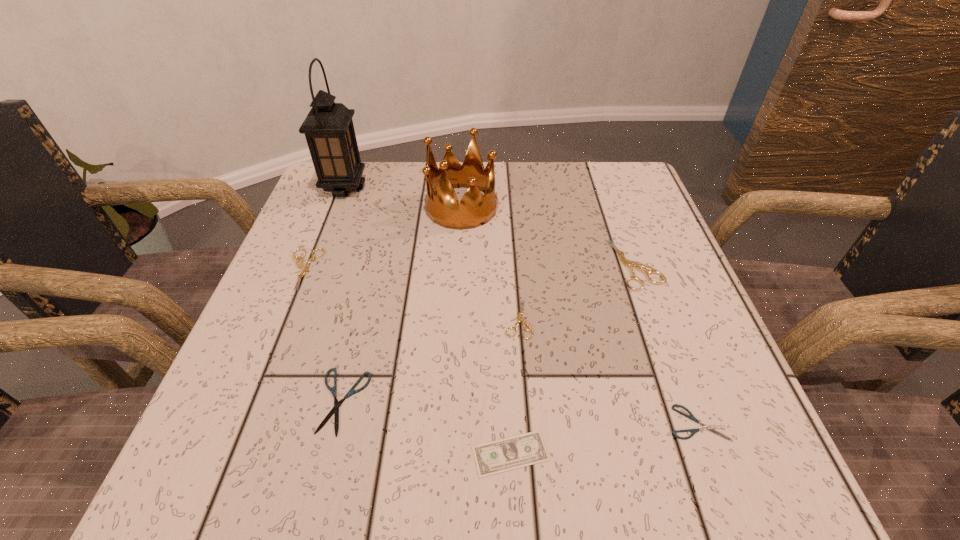
Identify the location of lantern. The height and width of the screenshot is (540, 960). 329,130.

Locate an element on the screen. The image size is (960, 540). black lantern is located at coordinates pyautogui.click(x=329, y=130).

Find the location of a particular element. Image resolution: width=960 pixels, height=540 pixels. the seventh shortest object is located at coordinates (442, 206).

Locate an element on the screen. The height and width of the screenshot is (540, 960). the tallest shears is located at coordinates (629, 264).

You are a GUI agent. You are given a task and a screenshot of the screen. Output one action in this format:
    pyautogui.click(x=<x>, y=<y>)
    Task: Click on the rightmost beige shears
    
    Given the screenshot: What is the action you would take?
    pyautogui.click(x=629, y=264)

This screenshot has height=540, width=960. Find the location of `the leftmost beige shears`. the leftmost beige shears is located at coordinates (300, 264).

You are a GUI agent. You are given a task and a screenshot of the screen. Output one action in this format:
    pyautogui.click(x=<x>, y=<y>)
    Task: Click on the fifth shortest object
    
    Given the screenshot: What is the action you would take?
    pyautogui.click(x=300, y=264)

Image resolution: width=960 pixels, height=540 pixels. Find the location of `the third shears from left to right`. the third shears from left to right is located at coordinates [x=519, y=318].

Where is `the second beige shears from left to right`? This screenshot has height=540, width=960. the second beige shears from left to right is located at coordinates (519, 318).

What are the coordinates of `the left black shears` in the screenshot? It's located at (335, 410).